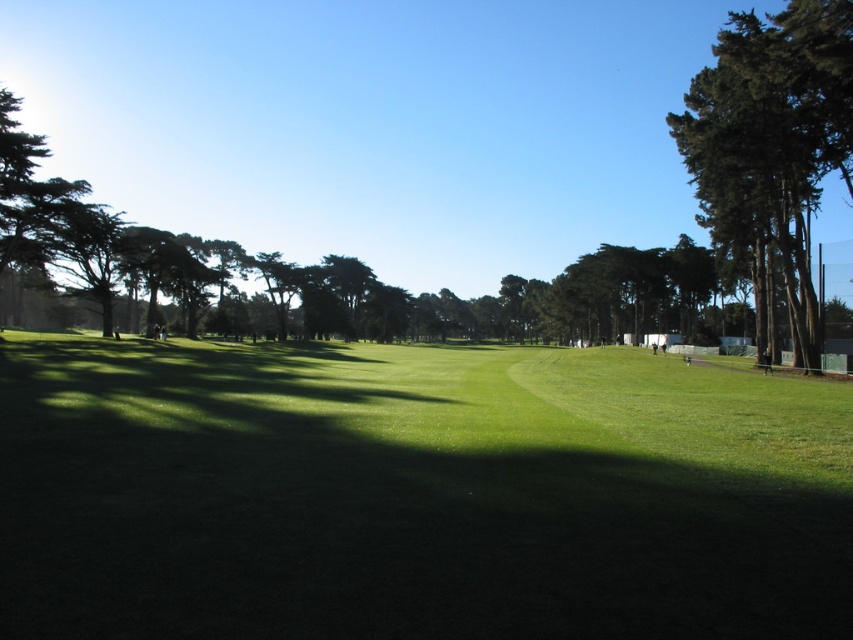
You are standing on the golf course and see the green grassy field at center and the green textured tree at right. Which object is positioned to the left of the other?

The green grassy field at center is to the left of the green textured tree at right.